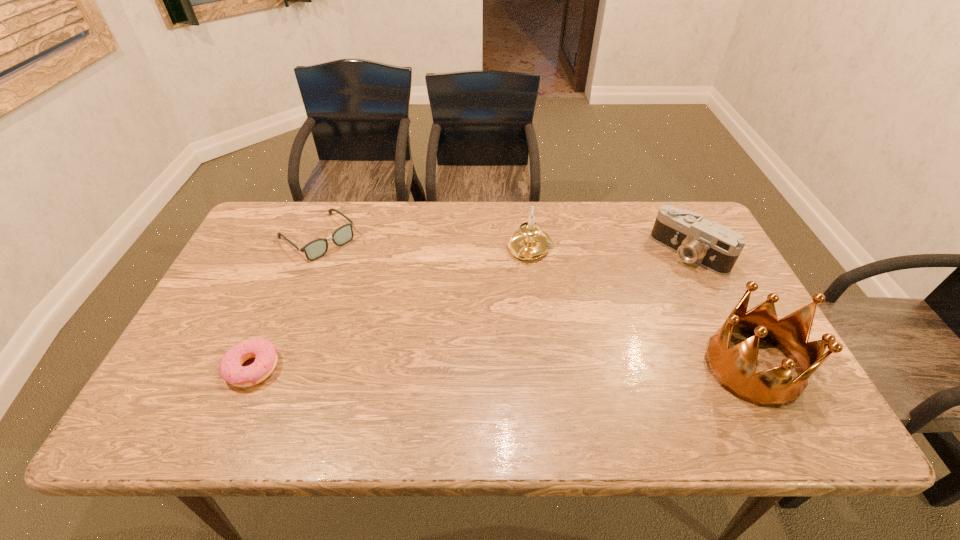
In order to click on doughnut in this screenshot , I will do `click(231, 370)`.

The height and width of the screenshot is (540, 960). I want to click on the tallest object, so click(x=734, y=368).

What are the coordinates of `the third object from right to left` in the screenshot? It's located at (530, 242).

Find the location of `the fourth shortest object`. the fourth shortest object is located at coordinates (530, 242).

The width and height of the screenshot is (960, 540). I want to click on spectacles, so click(x=315, y=249).

Find the location of a particular element. the third tallest object is located at coordinates (715, 247).

Where is `vacant space positioned 0.220m on the back of the doughnut`? vacant space positioned 0.220m on the back of the doughnut is located at coordinates (290, 281).

Where is `vacant space situated on the back of the crown`? This screenshot has width=960, height=540. vacant space situated on the back of the crown is located at coordinates (710, 286).

Identify the location of vacant space located 0.180m on the handle side of the fourth shortest object. (495, 307).

The width and height of the screenshot is (960, 540). I want to click on vacant region located 0.340m on the handle side of the fourth shortest object, so (468, 352).